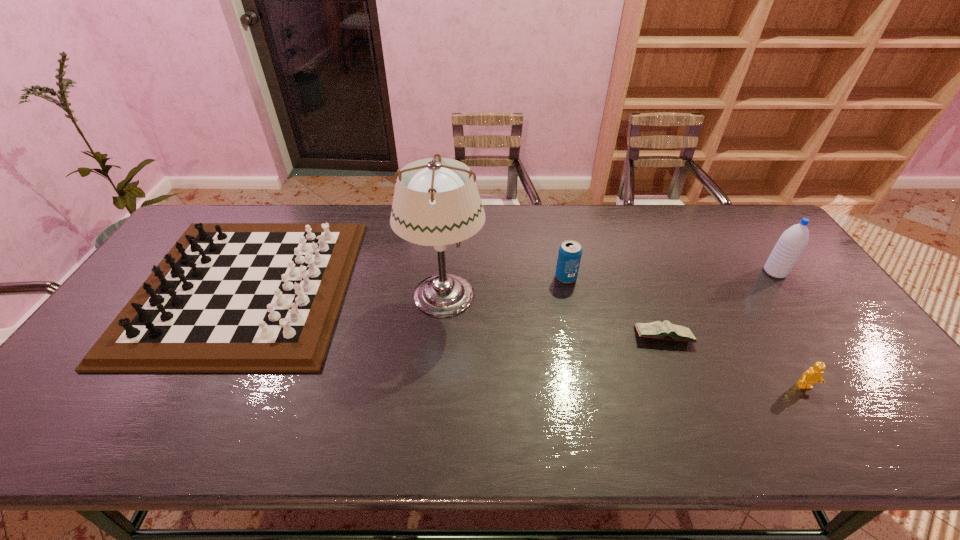
Locate an element on the screen. This screenshot has width=960, height=540. vacant space that is in between the diary and the water bottle is located at coordinates (719, 305).

Locate an element on the screen. The image size is (960, 540). vacant region between the fifth tallest object and the fourth object from left to right is located at coordinates 734,362.

You are a GUI agent. You are given a task and a screenshot of the screen. Output one action in this format:
    pyautogui.click(x=<x>, y=<y>)
    Task: Click on the free space between the third object from left to right and the rightmost object
    This screenshot has height=540, width=960.
    Given the screenshot: What is the action you would take?
    pyautogui.click(x=670, y=275)

Image resolution: width=960 pixels, height=540 pixels. What are the coordinates of `free spot between the tallest object and the fifth shortest object` in the screenshot? It's located at (610, 284).

At what (x,y) coordinates should I click in order to perform the action: click on object that is the fifth closest one to the gameboard. Please return your answer as a coordinate pair (x, y). The width and height of the screenshot is (960, 540). Looking at the image, I should click on (x=792, y=242).

The image size is (960, 540). I want to click on object that stands as the closest to the soda can, so click(665, 330).